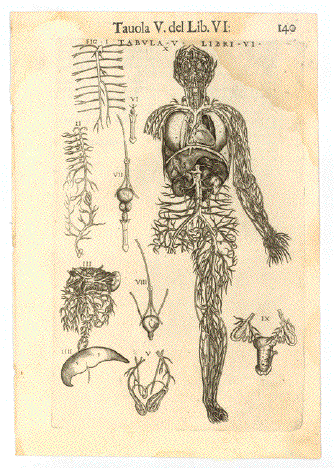
The height and width of the screenshot is (468, 334). Identify the location of sheet of paper from a book or binder. 267,416.